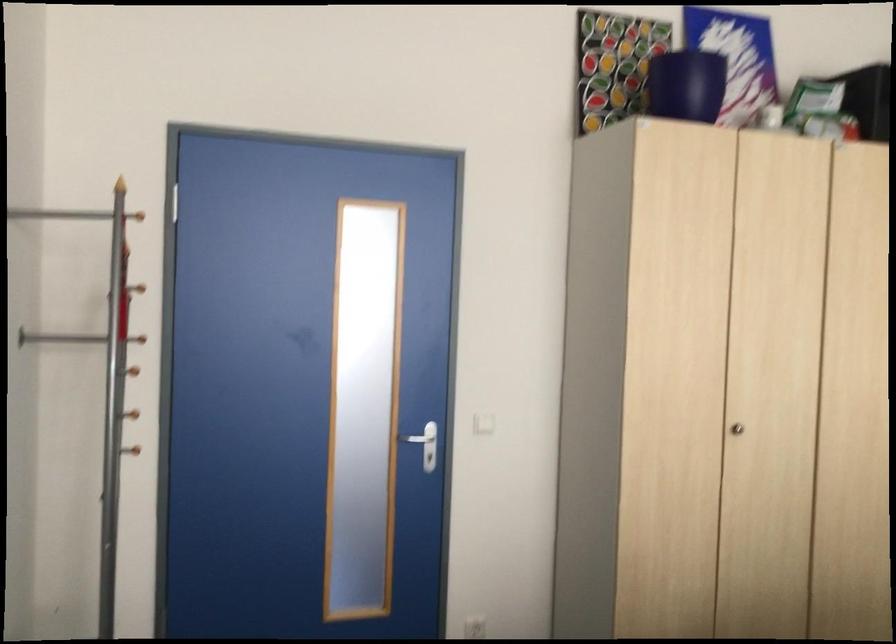
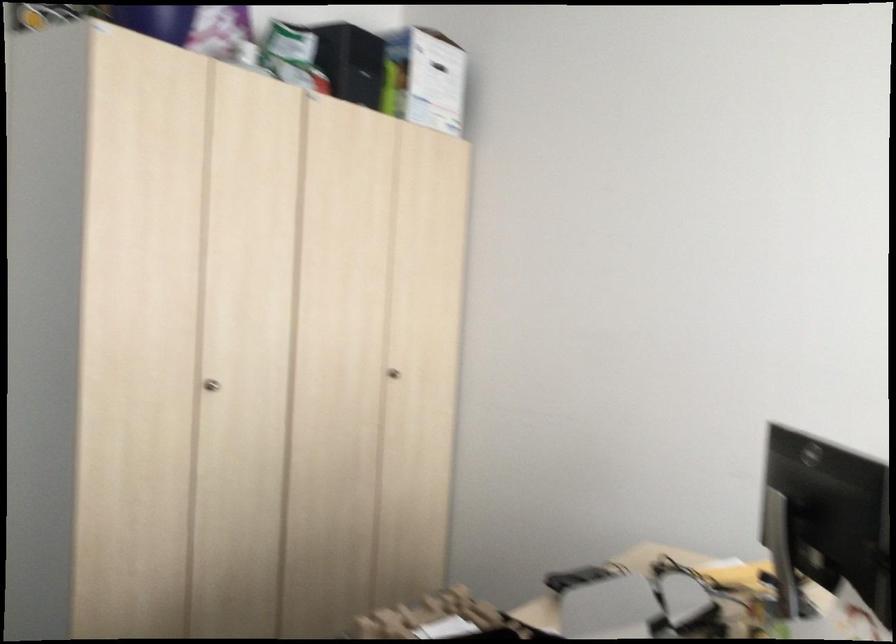
Locate, in the second image, the point that corresponds to point 744,442 in the first image.

(211, 384)